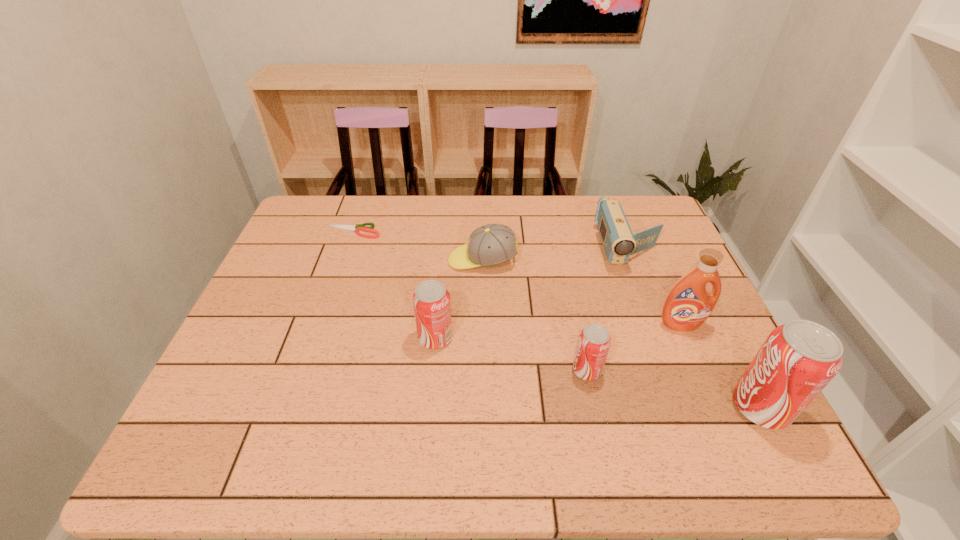
Locate which soda can is the second closest to the tallest soda can. Please provide its 2D coordinates. Your answer should be formatted as a tuple, i.e. [(x, y)], where the tuple contains the x and y coordinates of a point satisfying the conditions above.

[(431, 300)]

I want to click on the closest soda can to the second soda can from left to right, so click(x=798, y=359).

Locate an element on the screen. The width and height of the screenshot is (960, 540). free space that satisfies the following two spatial constraints: 1. on the side of the camcorder with the flip-out screen; 2. on the front-facing side of the baseball cap is located at coordinates (633, 260).

Find the location of a particular element. The height and width of the screenshot is (540, 960). free space that satisfies the following two spatial constraints: 1. on the side of the camcorder with the flip-out screen; 2. on the logo side of the second shortest soda can is located at coordinates (663, 338).

The height and width of the screenshot is (540, 960). Find the location of `blank area in the image that satisfies the following two spatial constraints: 1. on the side of the camcorder with the flip-out screen; 2. on the front-facing side of the baseball cap`. blank area in the image that satisfies the following two spatial constraints: 1. on the side of the camcorder with the flip-out screen; 2. on the front-facing side of the baseball cap is located at coordinates (633, 260).